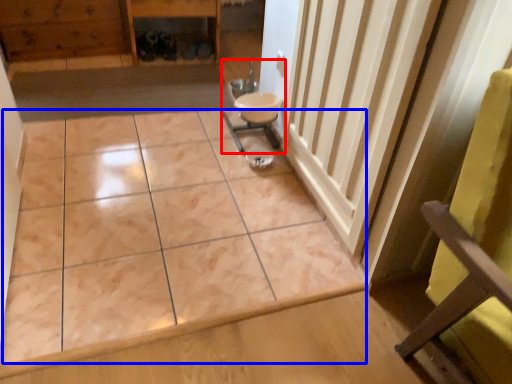
Question: Which object appears closest to the camera in this image, sink (highlighted by a red box) or ceramic tile (highlighted by a blue box)?

Choices:
 (A) sink
 (B) ceramic tile

Answer: (B)